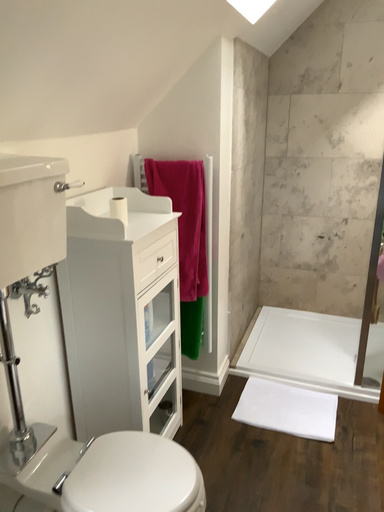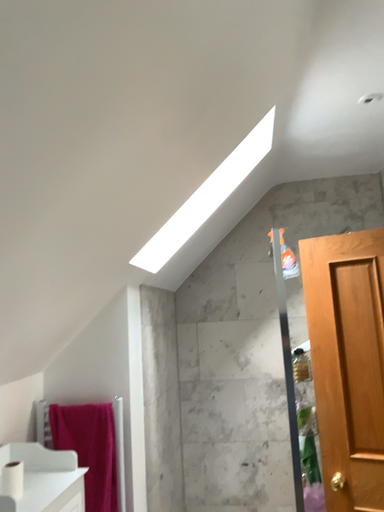
Question: Which way did the camera rotate in the video?

Choices:
 (A) rotated right
 (B) rotated left

Answer: (A)